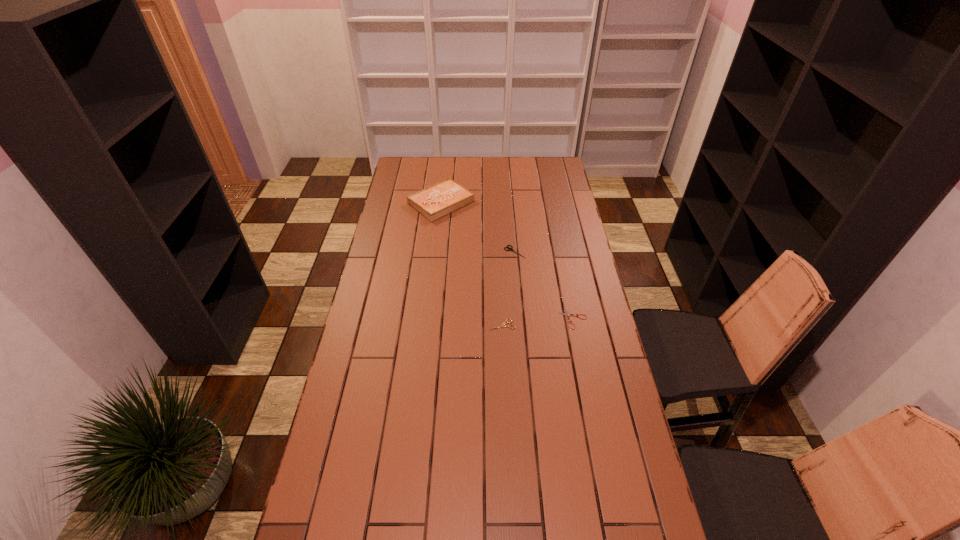
The height and width of the screenshot is (540, 960). In order to click on shears object that ranks as the closest to the shortest shears in this screenshot , I will do `click(504, 323)`.

Choose which shears is the nearest neighbor to the farthest shears. Please provide its 2D coordinates. Your answer should be formatted as a tuple, i.e. [(x, y)], where the tuple contains the x and y coordinates of a point satisfying the conditions above.

[(567, 314)]

Locate an element on the screen. The image size is (960, 540). free spot that satisfies the following two spatial constraints: 1. on the front side of the rightmost object; 2. on the right side of the farthest shears is located at coordinates (520, 319).